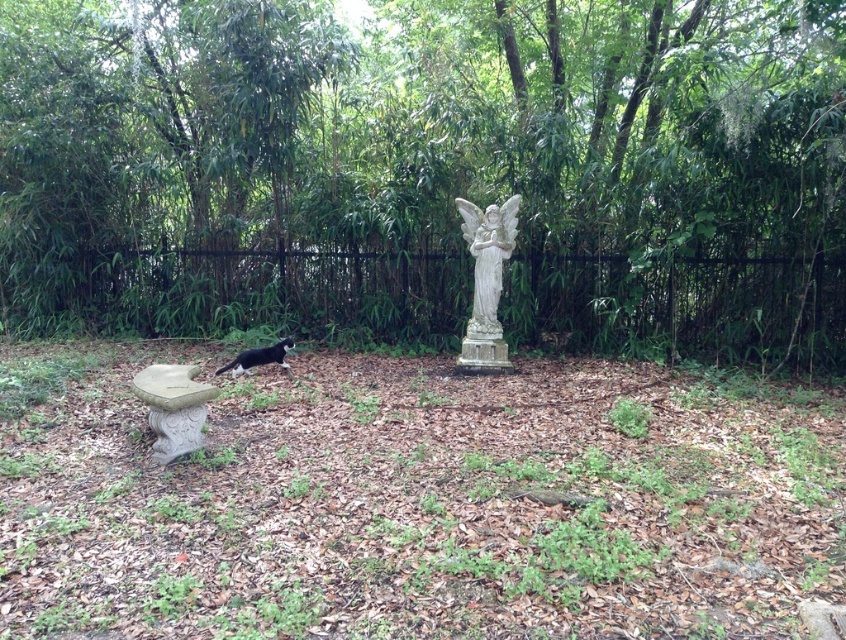
From the picture: Is white stone statue at center to the right of black metal fence at center from the viewer's perspective?

Correct, you'll find white stone statue at center to the right of black metal fence at center.

Which is behind, point (364, 611) or point (580, 298)?

The point (580, 298) is behind.

Is point (438, 371) positioned in front of point (838, 364)?

Yes, point (438, 371) is closer to viewer.

Where is `white stone statue at center`? white stone statue at center is located at coordinates (415, 500).

Can you confirm if green leafy tree at center is bigger than black and white fur cat at lower left?

Incorrect, green leafy tree at center is not larger than black and white fur cat at lower left.

Is point (321, 113) positioned after point (283, 346)?

Yes.

What are the coordinates of `green leafy tree at center` in the screenshot? It's located at (429, 170).

Does black metal fence at center come behind white stone angel at center?

Yes.

Does black metal fence at center have a lesser width compared to white stone angel at center?

Correct, black metal fence at center's width is less than white stone angel at center's.

Describe the element at coordinates (251, 292) in the screenshot. Image resolution: width=846 pixels, height=640 pixels. I see `black metal fence at center` at that location.

Identify the location of black metal fence at center. The image size is (846, 640). (251, 292).